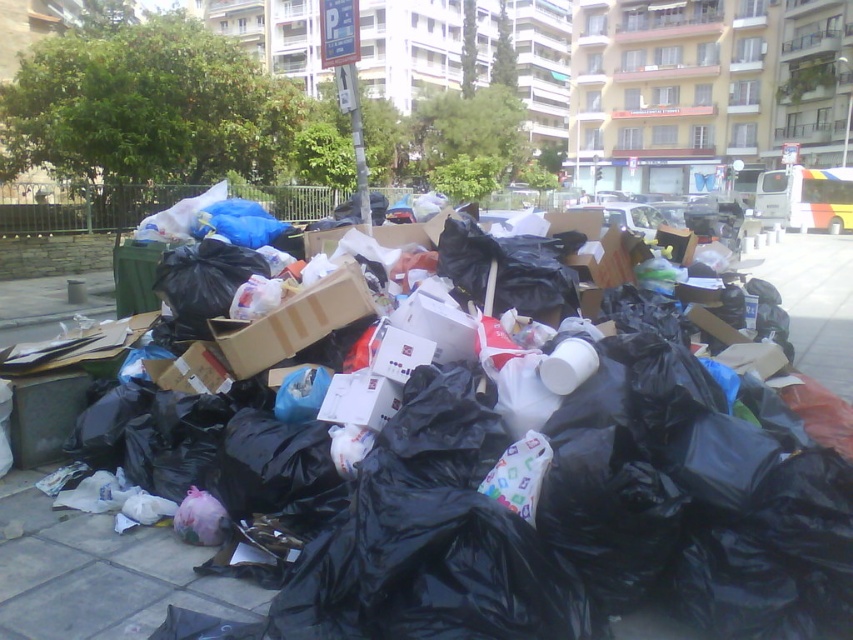
You are standing at the origin point of the image. Which object is located at point [817,301]?

The black plastic bags at center is located at point [817,301].

You are a waste collector standing behind the black plastic bags at center and the brown cardboard box at center. Which object is closer to you?

The black plastic bags at center are closer to you because they are in front of the brown cardboard box at center.